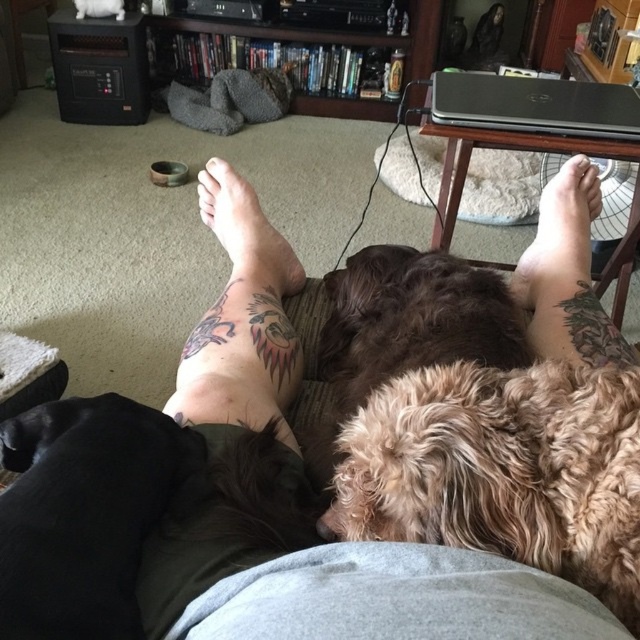
You are standing at the center of the room and want to throw a ball to the black fur dog at lower left. According to the coordinates provided, in which direction should you aim to reach the dog?

The black fur dog at lower left is located at coordinates point (86, 513), so you should aim to the lower left direction to reach the dog.

You are a delivery robot with a package that needs to be placed between the brown furry foot at upper right and the pale skin at center. The package is 23 inches long. Will it fit between them?

The distance between the brown furry foot at upper right and the pale skin at center is 22.99 inches. Since the package is 23 inches long, it will not fit between them as the space is slightly smaller than the package.